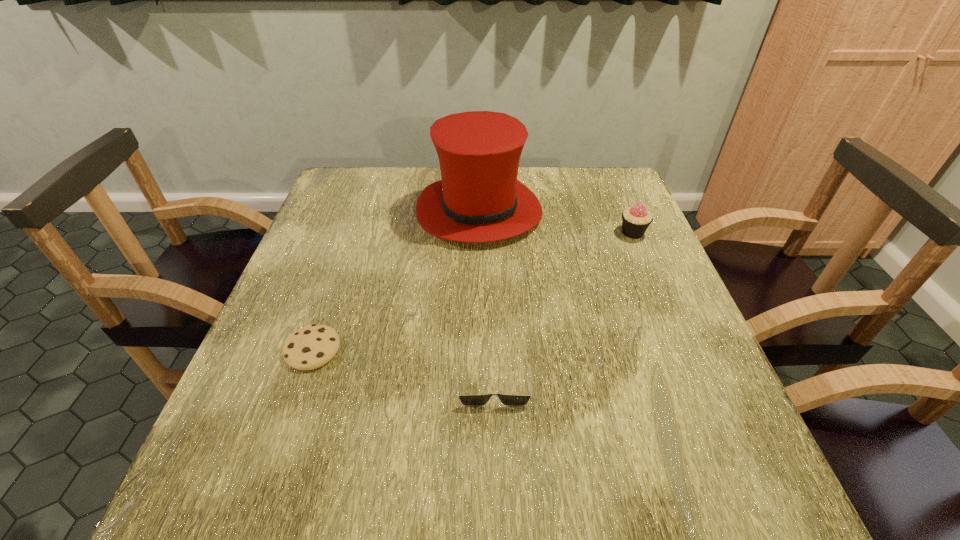
Where is `unoccupied area between the rightmost object and the hat`? The image size is (960, 540). unoccupied area between the rightmost object and the hat is located at coordinates (556, 222).

You are a GUI agent. You are given a task and a screenshot of the screen. Output one action in this format:
    pyautogui.click(x=<x>, y=<y>)
    Task: Click on the free space between the sunglasses and the leftmost object
    
    Given the screenshot: What is the action you would take?
    pyautogui.click(x=403, y=364)

Locate an element on the screen. This screenshot has height=540, width=960. empty space that is in between the sunglasses and the tallest object is located at coordinates (486, 295).

You are a GUI agent. You are given a task and a screenshot of the screen. Output one action in this format:
    pyautogui.click(x=<x>, y=<y>)
    Task: Click on the vacant region between the cookie and the third shortest object
    
    Given the screenshot: What is the action you would take?
    pyautogui.click(x=472, y=291)

Where is `empty space between the leftmost object and the tallest object`? empty space between the leftmost object and the tallest object is located at coordinates (396, 281).

Locate an element on the screen. Image resolution: width=960 pixels, height=540 pixels. empty space between the third shortest object and the sunglasses is located at coordinates [564, 306].

At what (x,y) coordinates should I click in order to perform the action: click on empty space between the second tallest object and the cookie. Please return your answer as a coordinate pair (x, y). Looking at the image, I should click on (472, 291).

This screenshot has height=540, width=960. Identify the location of free spot between the cookie and the sunglasses. (403, 364).

Where is `object that is the second closest to the cookie`? Image resolution: width=960 pixels, height=540 pixels. object that is the second closest to the cookie is located at coordinates (x=479, y=199).

This screenshot has height=540, width=960. Find the location of `the third closest object to the sunglasses`. the third closest object to the sunglasses is located at coordinates (635, 220).